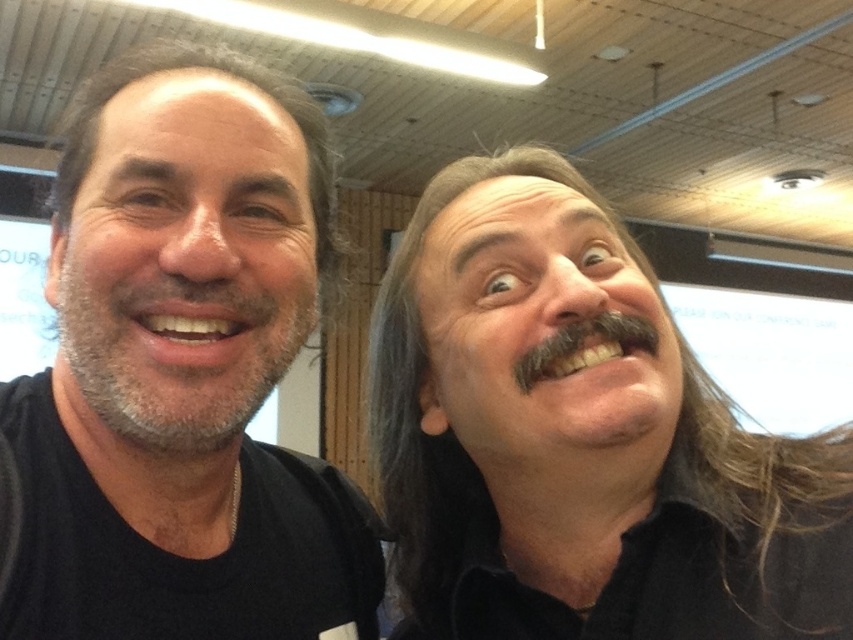
Who is positioned more to the left, matte black shirt at left or smooth skin face at left?

From the viewer's perspective, smooth skin face at left appears more on the left side.

Does matte black shirt at left appear under smooth skin face at left?

Yes.

Between point (320, 307) and point (202, 202), which one is positioned behind?

Point (320, 307)

Identify the location of matte black shirt at left. This screenshot has width=853, height=640. (181, 372).

Is matte black shirt at left above black matte mustache at right?

Yes.

This screenshot has width=853, height=640. Identify the location of matte black shirt at left. (181, 372).

Is black matte mustache at right to the left of smooth skin face at center from the viewer's perspective?

In fact, black matte mustache at right is to the right of smooth skin face at center.

Does black matte mustache at right have a greater height compared to smooth skin face at center?

Indeed, black matte mustache at right has a greater height compared to smooth skin face at center.

Which is in front, point (587, 227) or point (543, 189)?

Point (587, 227) is in front.

This screenshot has width=853, height=640. I want to click on black matte mustache at right, so (x=579, y=436).